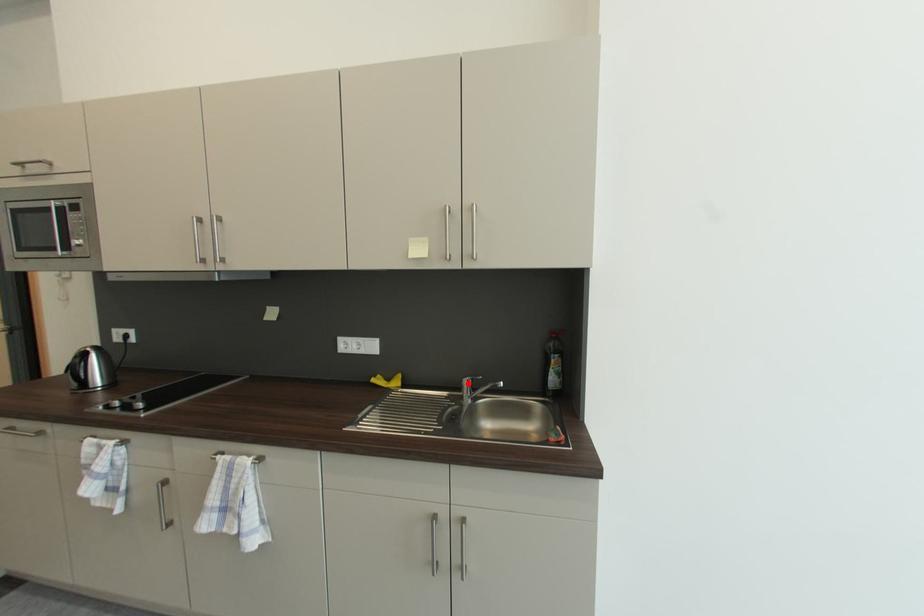
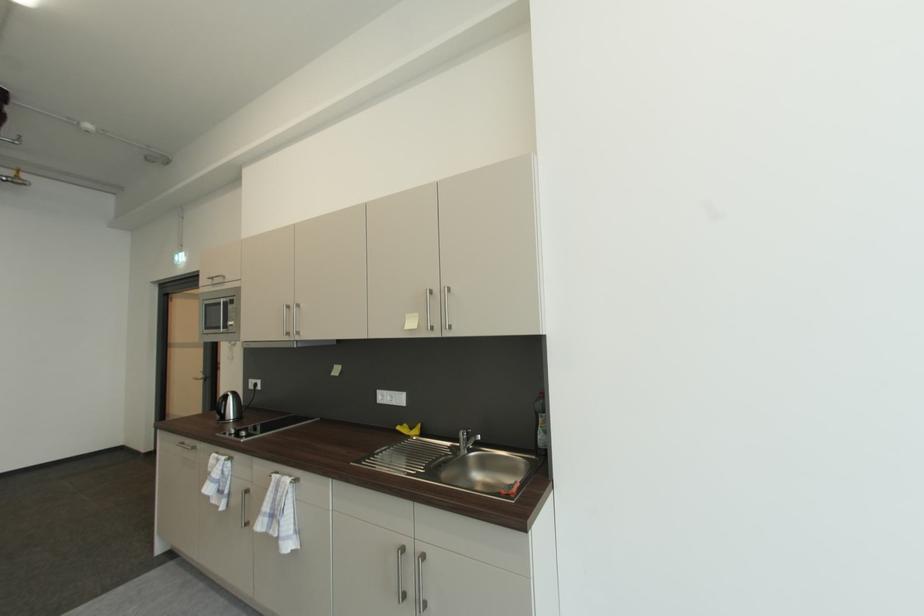
Locate, in the second image, the point that corresponds to the highlighted location in the first image.

(465, 435)